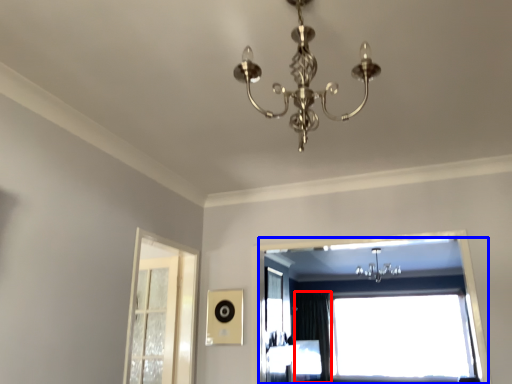
Question: Which point is further to the camera, curtain (highlighted by a red box) or window (highlighted by a blue box)?

Choices:
 (A) curtain
 (B) window

Answer: (A)